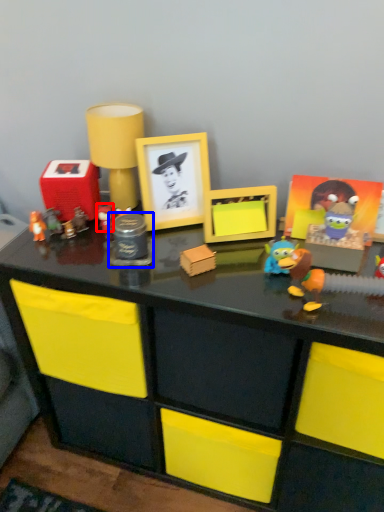
Question: Among these objects, which one is farthest to the camera, toy (highlighted by a red box) or toy (highlighted by a blue box)?

Choices:
 (A) toy
 (B) toy

Answer: (A)